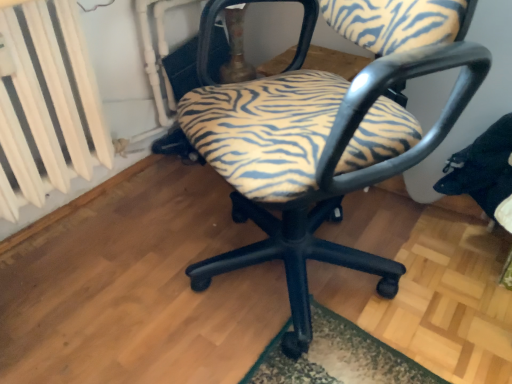
Question: Is zebra-patterned fabric chair at center turned away from white painted metal radiator at left?

Choices:
 (A) no
 (B) yes

Answer: (A)

Question: Considering the relative sizes of zebra-patterned fabric chair at center and white painted metal radiator at left in the image provided, is zebra-patterned fabric chair at center wider than white painted metal radiator at left?

Choices:
 (A) no
 (B) yes

Answer: (B)

Question: From a real-world perspective, is zebra-patterned fabric chair at center located higher than white painted metal radiator at left?

Choices:
 (A) no
 (B) yes

Answer: (A)

Question: Is zebra-patterned fabric chair at center smaller than white painted metal radiator at left?

Choices:
 (A) yes
 (B) no

Answer: (B)

Question: Considering the relative positions of zebra-patterned fabric chair at center and white painted metal radiator at left in the image provided, is zebra-patterned fabric chair at center to the right of white painted metal radiator at left from the viewer's perspective?

Choices:
 (A) no
 (B) yes

Answer: (B)

Question: Is zebra-patterned fabric chair at center far away from white painted metal radiator at left?

Choices:
 (A) yes
 (B) no

Answer: (B)

Question: Are white painted metal radiator at left and zebra-patterned fabric chair at center beside each other?

Choices:
 (A) no
 (B) yes

Answer: (A)

Question: Is white painted metal radiator at left shorter than zebra-patterned fabric chair at center?

Choices:
 (A) yes
 (B) no

Answer: (A)

Question: Is white painted metal radiator at left located outside zebra-patterned fabric chair at center?

Choices:
 (A) yes
 (B) no

Answer: (A)

Question: Can you confirm if white painted metal radiator at left is wider than zebra-patterned fabric chair at center?

Choices:
 (A) no
 (B) yes

Answer: (A)

Question: From the image's perspective, is white painted metal radiator at left above zebra-patterned fabric chair at center?

Choices:
 (A) no
 (B) yes

Answer: (B)

Question: From the image's perspective, is white painted metal radiator at left below zebra-patterned fabric chair at center?

Choices:
 (A) no
 (B) yes

Answer: (A)

Question: In the image, is white painted metal radiator at left positioned in front of or behind zebra-patterned fabric chair at center?

Choices:
 (A) behind
 (B) front

Answer: (A)